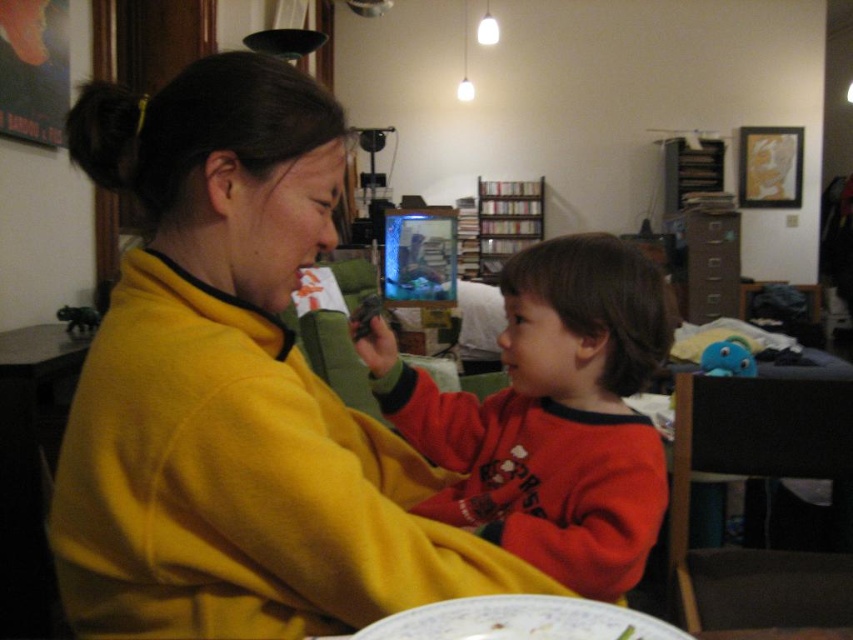
Question: Is yellow fleece at center behind porcelain plate at lower center?

Choices:
 (A) no
 (B) yes

Answer: (B)

Question: Can you confirm if yellow fleece at center is positioned above porcelain plate at lower center?

Choices:
 (A) no
 (B) yes

Answer: (B)

Question: Which point is closer to the camera taking this photo?

Choices:
 (A) (468, 608)
 (B) (538, 500)
 (C) (120, 484)

Answer: (A)

Question: Which object appears farthest from the camera in this image?

Choices:
 (A) red fleece sweater at center
 (B) porcelain plate at lower center

Answer: (A)

Question: Can you confirm if red fleece sweater at center is wider than porcelain plate at lower center?

Choices:
 (A) no
 (B) yes

Answer: (B)

Question: Which is nearer to the red fleece sweater at center?

Choices:
 (A) yellow fleece at center
 (B) porcelain plate at lower center

Answer: (A)